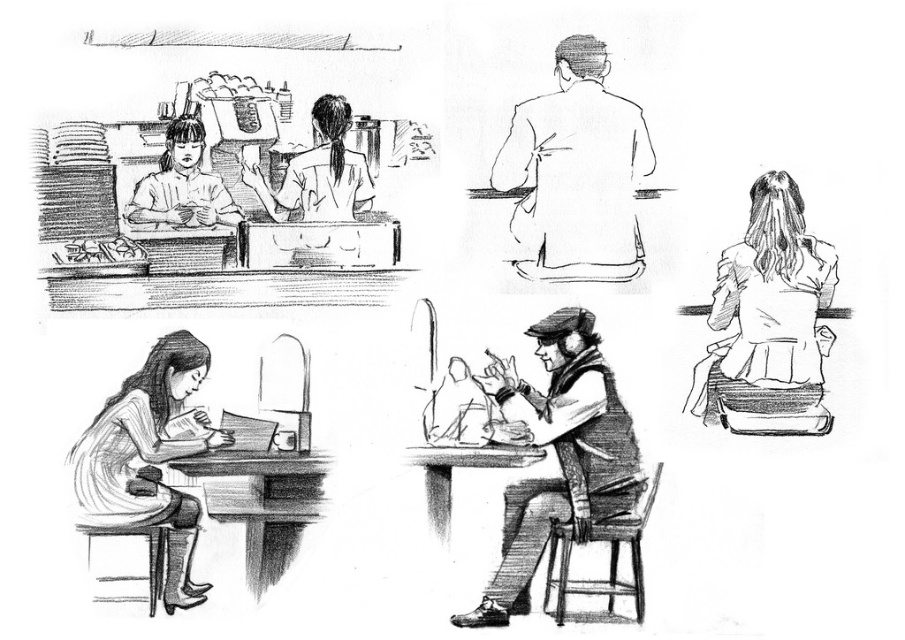
Question: Among these objects, which one is nearest to the camera?

Choices:
 (A) matte white blouse at upper left
 (B) smooth white blouse at center
 (C) smooth beige jacket at upper center
 (D) dark gray woolen hat at center

Answer: (D)

Question: Which of the following is the closest to the observer?

Choices:
 (A) white matte jacket at upper right
 (B) dark gray woolen hat at center
 (C) matte white blouse at upper left
 (D) smooth white blouse at center

Answer: (B)

Question: Which of the following is the closest to the observer?

Choices:
 (A) click(x=332, y=156)
 (B) click(x=135, y=488)
 (C) click(x=199, y=198)
 (D) click(x=734, y=392)

Answer: (B)

Question: Can you confirm if smooth white blouse at lower left is positioned below smooth white blouse at center?

Choices:
 (A) yes
 (B) no

Answer: (A)

Question: Does dark gray woolen hat at center have a greater width compared to smooth white blouse at center?

Choices:
 (A) no
 (B) yes

Answer: (B)

Question: Can you confirm if dark gray woolen hat at center is bigger than smooth white blouse at lower left?

Choices:
 (A) yes
 (B) no

Answer: (A)